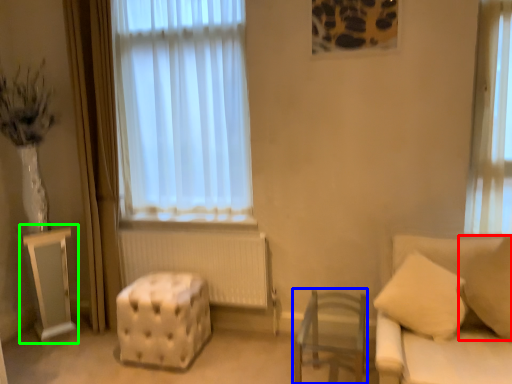
Question: Which object is positioned farthest from pillow (highlighted by a red box)? Select from furniture (highlighted by a blue box) and table (highlighted by a green box).

Choices:
 (A) furniture
 (B) table

Answer: (B)